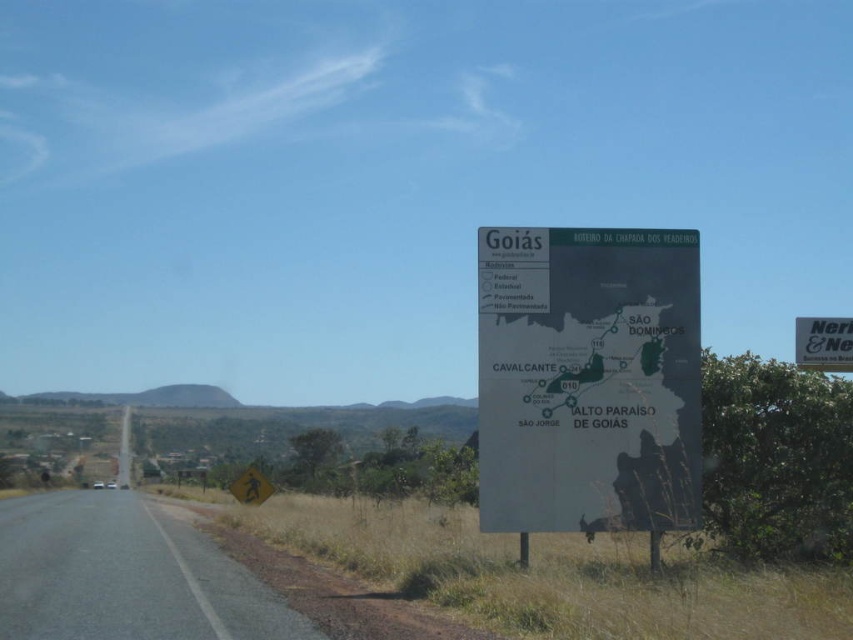
In the scene shown: You are driving a truck that is 2.5 meters wide. You see the gray asphalt road at lower left and the white plastic sign at right. Which of these two has a greater width?

The white plastic sign at right has a greater width than the gray asphalt road at lower left.

You are a tourist driving along this road and need to check the matte black map at right and the white plastic sign at right for directions. Which one is taller?

The matte black map at right is taller than the white plastic sign at right.